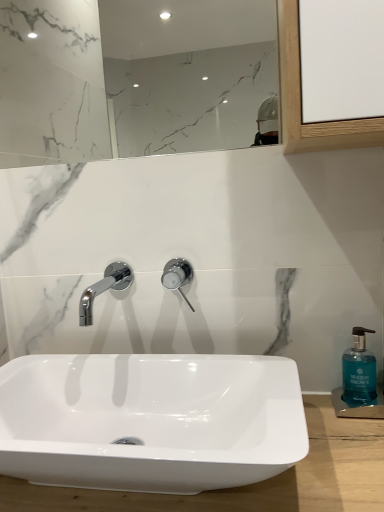
Question: Is teal glass soap dispenser at right to the right of white marble mirror at upper center from the viewer's perspective?

Choices:
 (A) yes
 (B) no

Answer: (A)

Question: Does teal glass soap dispenser at right turn towards white marble mirror at upper center?

Choices:
 (A) yes
 (B) no

Answer: (B)

Question: Is white marble mirror at upper center inside teal glass soap dispenser at right?

Choices:
 (A) no
 (B) yes

Answer: (A)

Question: Does teal glass soap dispenser at right touch white marble mirror at upper center?

Choices:
 (A) yes
 (B) no

Answer: (B)

Question: From the image's perspective, does teal glass soap dispenser at right appear lower than white marble mirror at upper center?

Choices:
 (A) no
 (B) yes

Answer: (B)

Question: Considering the relative sizes of teal glass soap dispenser at right and white marble mirror at upper center in the image provided, is teal glass soap dispenser at right wider than white marble mirror at upper center?

Choices:
 (A) yes
 (B) no

Answer: (A)

Question: Considering the relative sizes of polished chrome tap at center and teal glass soap dispenser at right in the image provided, is polished chrome tap at center taller than teal glass soap dispenser at right?

Choices:
 (A) yes
 (B) no

Answer: (B)

Question: Is teal glass soap dispenser at right at the back of polished chrome tap at center?

Choices:
 (A) yes
 (B) no

Answer: (B)

Question: Considering the relative sizes of polished chrome tap at center and teal glass soap dispenser at right in the image provided, is polished chrome tap at center smaller than teal glass soap dispenser at right?

Choices:
 (A) no
 (B) yes

Answer: (B)

Question: Is polished chrome tap at center with teal glass soap dispenser at right?

Choices:
 (A) yes
 (B) no

Answer: (B)

Question: Does polished chrome tap at center have a larger size compared to teal glass soap dispenser at right?

Choices:
 (A) no
 (B) yes

Answer: (A)

Question: Is polished chrome tap at center positioned before teal glass soap dispenser at right?

Choices:
 (A) no
 (B) yes

Answer: (A)

Question: Does polished chrome tap at center have a lesser width compared to white marble mirror at upper center?

Choices:
 (A) yes
 (B) no

Answer: (B)